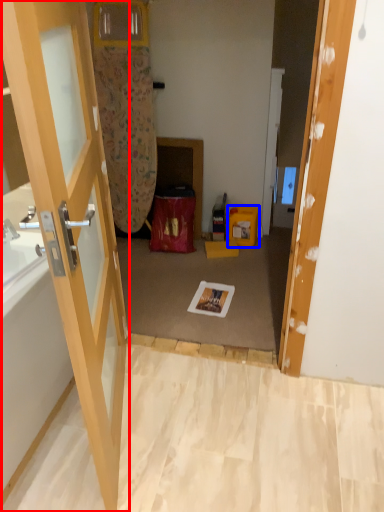
Question: Among these objects, which one is farthest to the camera, door (highlighted by a red box) or box (highlighted by a blue box)?

Choices:
 (A) door
 (B) box

Answer: (B)